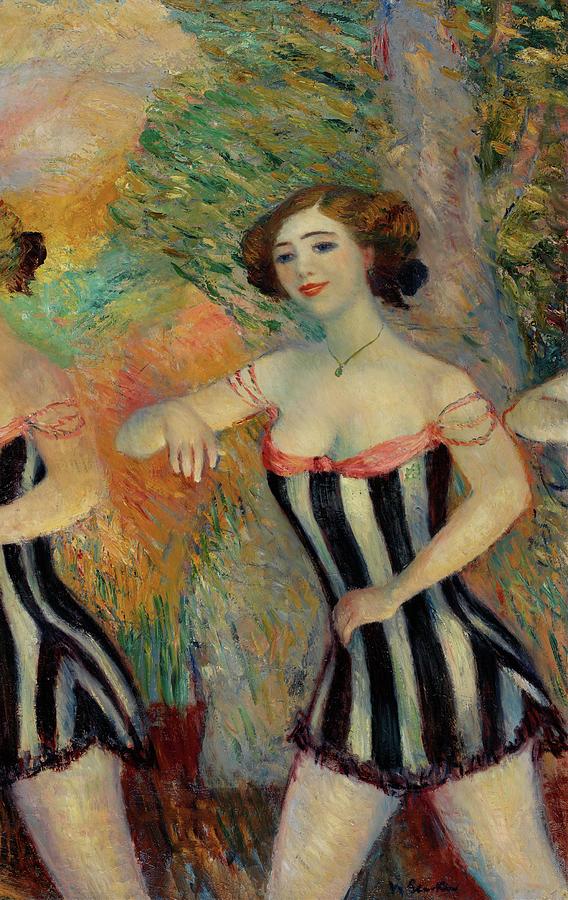
Locate an element on the screen. This screenshot has width=568, height=900. oil painting is located at coordinates (18, 12).